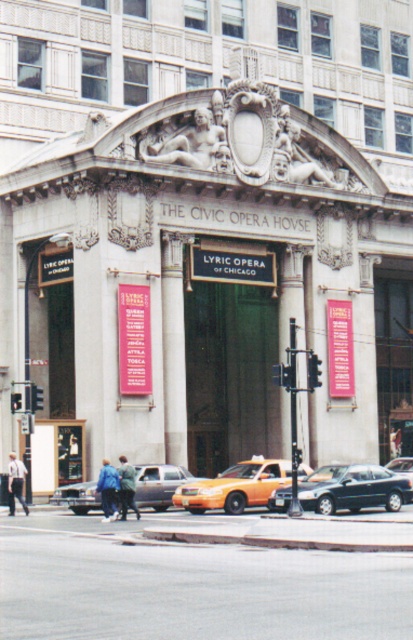
Question: Observing the image, what is the correct spatial positioning of shiny black sedan at center in reference to orange matte taxi at center?

Choices:
 (A) above
 (B) below

Answer: (A)

Question: Which object is the closest to the orange matte taxi at center?

Choices:
 (A) green fabric jacket at lower center
 (B) white shirt at lower left
 (C) shiny black sedan at center

Answer: (C)

Question: Is shiny black sedan at center bigger than metallic green sedan at center?

Choices:
 (A) yes
 (B) no

Answer: (B)

Question: Where is blue denim jacket at lower left located in relation to green fabric jacket at lower center in the image?

Choices:
 (A) left
 (B) right

Answer: (A)

Question: Which point is farther to the camera?

Choices:
 (A) (251, 476)
 (B) (346, 468)
 (C) (125, 481)
 (D) (398, 467)

Answer: (D)

Question: Among these points, which one is nearest to the camera?

Choices:
 (A) (408, 496)
 (B) (398, 461)
 (C) (102, 472)
 (D) (201, 488)

Answer: (C)